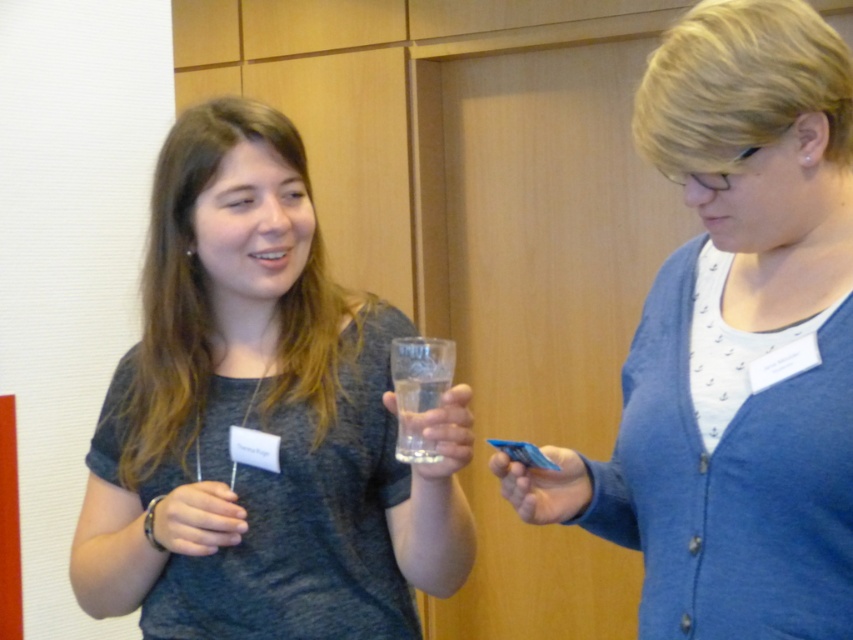
Is blue card at center bigger than blue plastic card at center?

Yes.

Describe the element at coordinates (744, 332) in the screenshot. I see `blue card at center` at that location.

Image resolution: width=853 pixels, height=640 pixels. What are the coordinates of `blue card at center` in the screenshot? It's located at (744, 332).

Is matte gray shirt at center taller than matte gray wristband at lower left?

Correct, matte gray shirt at center is much taller as matte gray wristband at lower left.

Image resolution: width=853 pixels, height=640 pixels. Describe the element at coordinates (258, 416) in the screenshot. I see `matte gray shirt at center` at that location.

Does point (125, 538) lie in front of point (164, 538)?

That is False.

Where is `matte gray shirt at center`? Image resolution: width=853 pixels, height=640 pixels. matte gray shirt at center is located at coordinates (258, 416).

How distant is blue plastic card at center from transparent glass at center?

blue plastic card at center is 4.19 inches away from transparent glass at center.

Between blue plastic card at center and transparent glass at center, which one is positioned lower?

blue plastic card at center is below.

Between point (515, 484) and point (432, 420), which one is positioned behind?

The point (515, 484) is more distant.

Where is `blue plastic card at center`? blue plastic card at center is located at coordinates (544, 484).